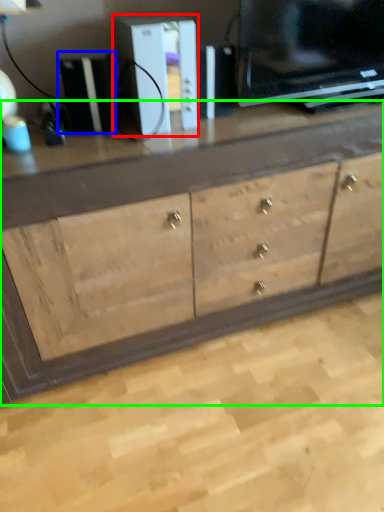
Question: Based on their relative distances, which object is nearer to appliance (highlighted by a red box)? Choose from appliance (highlighted by a blue box) and chest of drawers (highlighted by a green box).

Choices:
 (A) appliance
 (B) chest of drawers

Answer: (A)